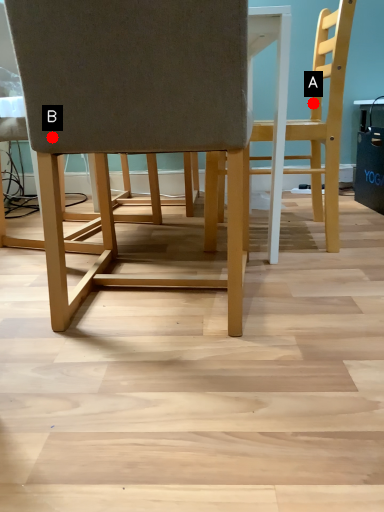
Question: Two points are circled on the image, labeled by A and B beside each circle. Among these points, which one is nearest to the camera?

Choices:
 (A) A is closer
 (B) B is closer

Answer: (B)